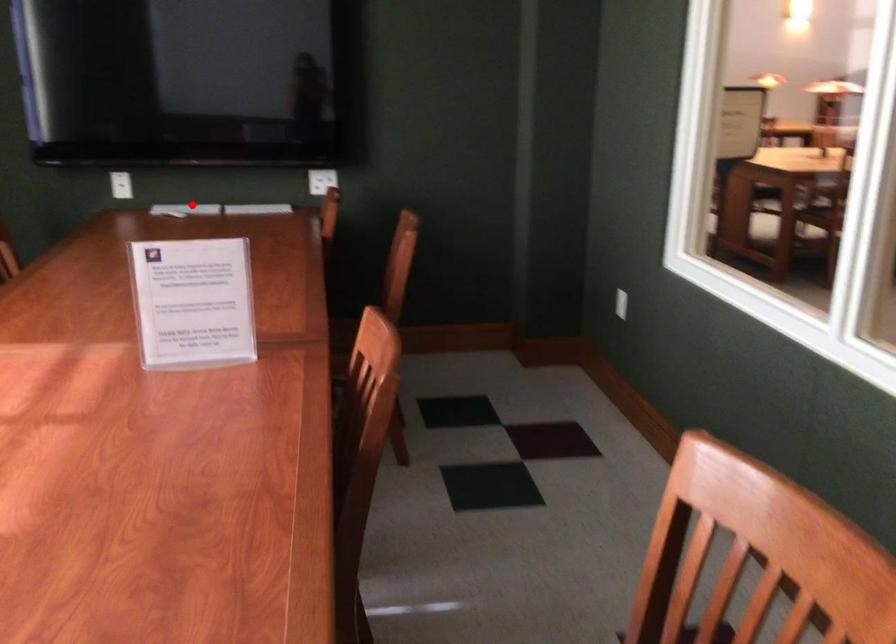
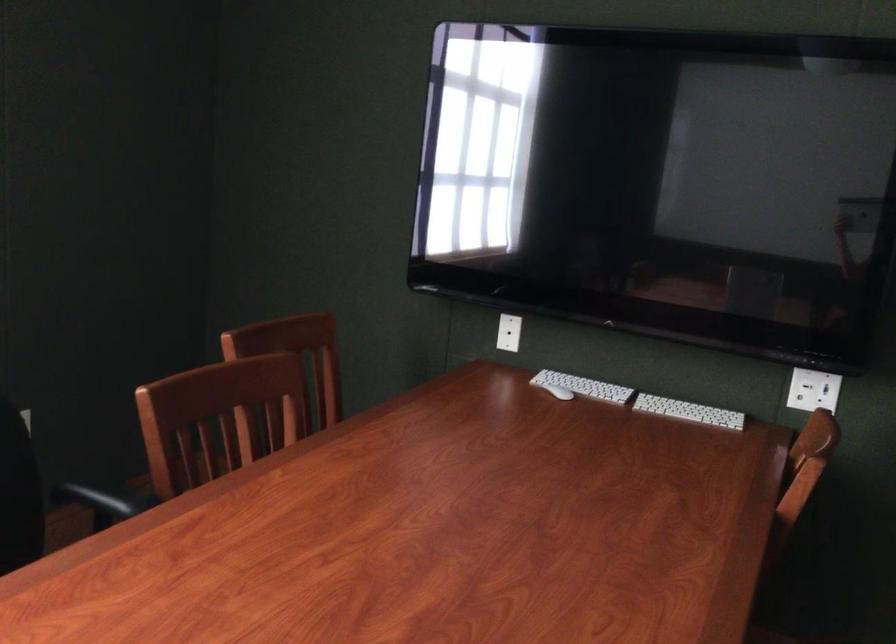
Question: I am providing you with two images of the same scene from different viewpoints. A red point is shown in image1. For the corresponding object point in image2, is it positioned nearer or farther from the camera?

Choices:
 (A) Nearer
 (B) Farther

Answer: (A)